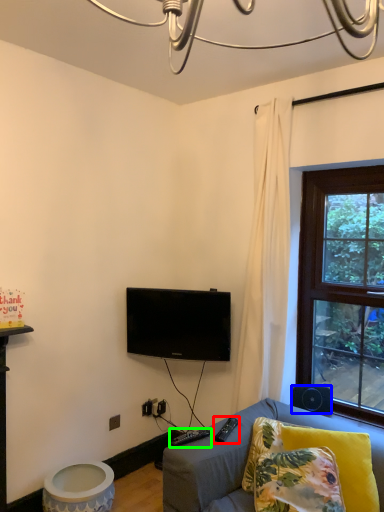
Question: Based on their relative distances, which object is nearer to remote (highlighted by a red box)? Choose from loudspeaker (highlighted by a blue box) and remote (highlighted by a green box).

Choices:
 (A) loudspeaker
 (B) remote

Answer: (B)